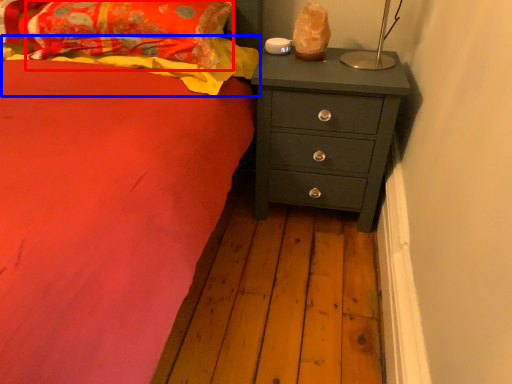
Question: Which point is further to the camera, pillow (highlighted by a red box) or blanket (highlighted by a blue box)?

Choices:
 (A) pillow
 (B) blanket

Answer: (B)